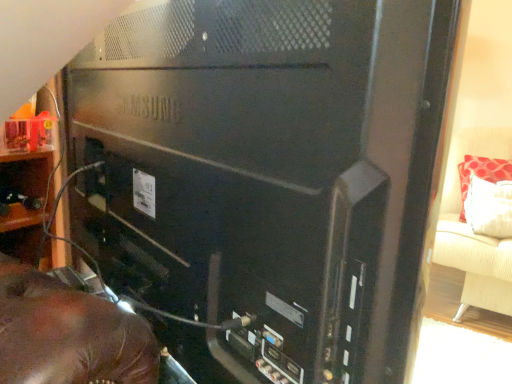
The width and height of the screenshot is (512, 384). I want to click on black matte computer tower at center, so click(x=238, y=257).

What is the approximate height of red fabric pillow at right?

red fabric pillow at right is 17.97 inches in height.

What do you see at coordinates (473, 233) in the screenshot? I see `beige fabric couch at right` at bounding box center [473, 233].

Find the location of `black matte computer tower at center`. black matte computer tower at center is located at coordinates (238, 257).

Between beige fabric couch at right and black matte computer tower at center, which one has more height?

black matte computer tower at center.

At what (x,y) coordinates should I click in order to perform the action: click on computer tower above the beige fabric couch at right (from the image's perspective). Please return your answer as a coordinate pair (x, y). The image size is (512, 384). Looking at the image, I should click on (238, 257).

Looking at the image, does beige fabric couch at right seem bigger or smaller compared to black matte computer tower at center?

beige fabric couch at right is bigger than black matte computer tower at center.

From the image's perspective, is beige fabric couch at right above black matte computer tower at center?

No.

Does beige fabric couch at right come behind red fabric pillow at right?

No, beige fabric couch at right is in front of red fabric pillow at right.

Find the location of `furniture below the red fabric pillow at right (from the image's perspective)`. furniture below the red fabric pillow at right (from the image's perspective) is located at coordinates (473, 233).

In the scene shown: From a real-world perspective, between beige fabric couch at right and red fabric pillow at right, who is vertically higher?

red fabric pillow at right, from a real-world perspective.

Is beige fabric couch at right turned away from red fabric pillow at right?

Yes, beige fabric couch at right is positioned with its back facing red fabric pillow at right.

Is wooden shelf at left to the left or to the right of black matte computer tower at center in the image?

wooden shelf at left is to the left of black matte computer tower at center.

In terms of width, does wooden shelf at left look wider or thinner when compared to black matte computer tower at center?

Considering their sizes, wooden shelf at left looks broader than black matte computer tower at center.

Does wooden shelf at left come behind black matte computer tower at center?

Yes.

Does point (0, 185) appear closer or farther from the camera than point (118, 288)?

Point (0, 185) is positioned farther from the camera compared to point (118, 288).

Can you confirm if wooden shelf at left is thinner than red fabric pillow at right?

Yes.

In the scene shown: Considering the relative positions of wooden shelf at left and red fabric pillow at right in the image provided, is wooden shelf at left to the left or to the right of red fabric pillow at right?

Based on their positions, wooden shelf at left is located to the left of red fabric pillow at right.

Who is smaller, wooden shelf at left or red fabric pillow at right?

wooden shelf at left is smaller.

From the image's perspective, who appears lower, wooden shelf at left or red fabric pillow at right?

wooden shelf at left appears lower in the image.

Does beige fabric couch at right turn towards wooden shelf at left?

No.

Which point is more distant from viewer, (499, 283) or (6, 246)?

Point (499, 283)

How distant is beige fabric couch at right from wooden shelf at left?

beige fabric couch at right is 6.09 feet from wooden shelf at left.

Which object is closer to the camera, beige fabric couch at right or wooden shelf at left?

Positioned in front is wooden shelf at left.

Which object is wider, black matte computer tower at center or red fabric pillow at right?

Wider between the two is red fabric pillow at right.

Consider the image. Is black matte computer tower at center oriented away from red fabric pillow at right?

That's not correct — black matte computer tower at center is not looking away from red fabric pillow at right.

Relative to red fabric pillow at right, is black matte computer tower at center in front or behind?

In the image, black matte computer tower at center appears in front of red fabric pillow at right.

Is black matte computer tower at center far from red fabric pillow at right?

Yes, black matte computer tower at center and red fabric pillow at right are located far from each other.

Is black matte computer tower at center positioned behind beige fabric couch at right?

No, it is not.

Is there a large distance between black matte computer tower at center and beige fabric couch at right?

Yes, black matte computer tower at center and beige fabric couch at right are quite far apart.

Considering the relative positions of black matte computer tower at center and beige fabric couch at right in the image provided, is black matte computer tower at center to the left of beige fabric couch at right from the viewer's perspective?

Correct, you'll find black matte computer tower at center to the left of beige fabric couch at right.

From their relative heights in the image, would you say black matte computer tower at center is taller or shorter than beige fabric couch at right?

In the image, black matte computer tower at center appears to be taller than beige fabric couch at right.

Image resolution: width=512 pixels, height=384 pixels. I want to click on furniture located on the right of black matte computer tower at center, so click(x=473, y=233).

Image resolution: width=512 pixels, height=384 pixels. I want to click on furniture in front of the red fabric pillow at right, so click(473, 233).

From the picture: Considering their positions, is beige fabric couch at right positioned further to wooden shelf at left than black matte computer tower at center?

beige fabric couch at right is further to wooden shelf at left.

Consider the image. From the image, which object appears to be farther from red fabric pillow at right, beige fabric couch at right or black matte computer tower at center?

black matte computer tower at center is positioned further to the anchor red fabric pillow at right.

When comparing their distances from red fabric pillow at right, does wooden shelf at left or beige fabric couch at right seem closer?

Based on the image, beige fabric couch at right appears to be nearer to red fabric pillow at right.

Estimate the real-world distances between objects in this image. Which object is further from red fabric pillow at right, wooden shelf at left or black matte computer tower at center?

wooden shelf at left is further to red fabric pillow at right.

From the image, which object appears to be nearer to red fabric pillow at right, black matte computer tower at center or beige fabric couch at right?

beige fabric couch at right is closer to red fabric pillow at right.

Based on the photo, estimate the real-world distances between objects in this image. Which object is closer to black matte computer tower at center, wooden shelf at left or beige fabric couch at right?

Based on the image, wooden shelf at left appears to be nearer to black matte computer tower at center.

Which object lies nearer to the anchor point beige fabric couch at right, black matte computer tower at center or wooden shelf at left?

black matte computer tower at center is closer to beige fabric couch at right.

Considering their positions, is wooden shelf at left positioned closer to beige fabric couch at right than red fabric pillow at right?

Based on the image, red fabric pillow at right appears to be nearer to beige fabric couch at right.

Where is `computer tower located between wooden shelf at left and beige fabric couch at right in the left-right direction`? This screenshot has width=512, height=384. computer tower located between wooden shelf at left and beige fabric couch at right in the left-right direction is located at coordinates (238, 257).

At what (x,y) coordinates should I click in order to perform the action: click on furniture positioned between black matte computer tower at center and red fabric pillow at right from near to far. Please return your answer as a coordinate pair (x, y). Looking at the image, I should click on (473, 233).

The image size is (512, 384). I want to click on computer tower between wooden shelf at left and red fabric pillow at right in the horizontal direction, so click(238, 257).

Where is `furniture located between wooden shelf at left and red fabric pillow at right in the left-right direction`? This screenshot has height=384, width=512. furniture located between wooden shelf at left and red fabric pillow at right in the left-right direction is located at coordinates (473, 233).